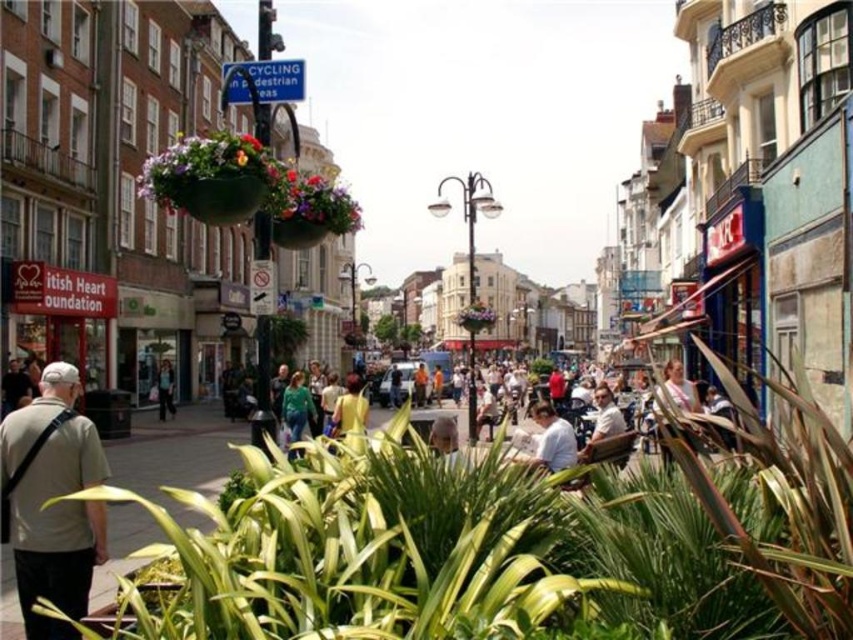
Question: Which point appears closest to the camera in this image?

Choices:
 (A) (300, 374)
 (B) (318, 225)
 (C) (164, 413)

Answer: (B)

Question: Is yellow fabric at center further to the viewer compared to light brown leather jacket at center?

Choices:
 (A) no
 (B) yes

Answer: (A)

Question: Can you confirm if matte plastic flower basket at upper left is smaller than light brown leather jacket at lower left?

Choices:
 (A) yes
 (B) no

Answer: (B)

Question: Is green leafy plant at lower left further to the viewer compared to yellow fabric at center?

Choices:
 (A) yes
 (B) no

Answer: (B)

Question: Which point appears farthest from the camera in this image?

Choices:
 (A) (827, 614)
 (B) (258, 148)

Answer: (B)

Question: Which point is farther to the camera?

Choices:
 (A) yellow fabric at center
 (B) green leafy plant at lower left
 (C) floral hanging basket at center

Answer: (A)